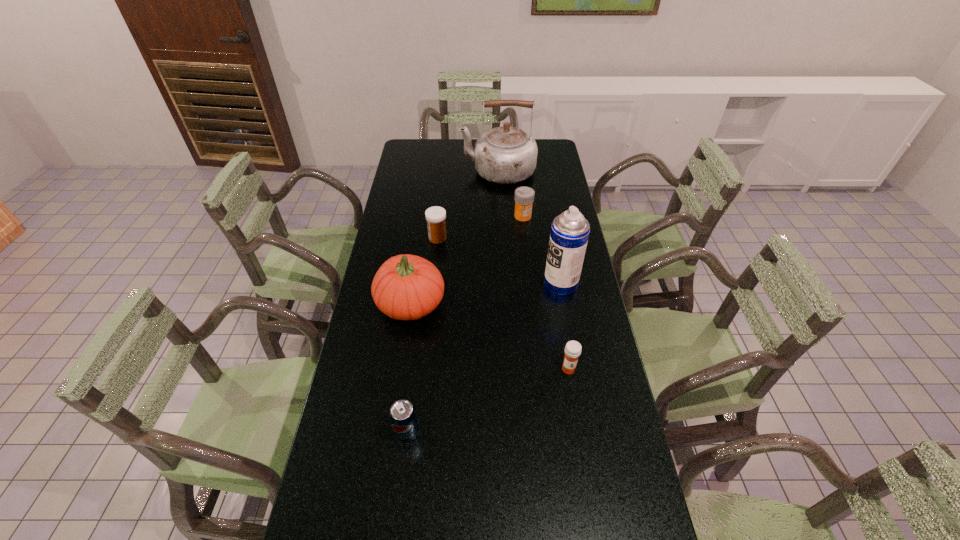
This screenshot has width=960, height=540. What are the coordinates of `the farthest object` in the screenshot? It's located at (505, 155).

Image resolution: width=960 pixels, height=540 pixels. Find the location of `aerosol can`. aerosol can is located at coordinates (569, 235).

The height and width of the screenshot is (540, 960). Find the location of `the fifth shortest object`. the fifth shortest object is located at coordinates (406, 287).

Where is `the second nearest medicine`? The image size is (960, 540). the second nearest medicine is located at coordinates (436, 216).

You are a GUI agent. You are given a task and a screenshot of the screen. Output one action in this format:
    pyautogui.click(x=<x>, y=<y>)
    Task: Click on the third farthest object
    
    Given the screenshot: What is the action you would take?
    pyautogui.click(x=436, y=216)

This screenshot has width=960, height=540. I want to click on the second medicine from left to right, so click(524, 196).

You are a GUI agent. You are given a task and a screenshot of the screen. Output one action in this format:
    pyautogui.click(x=<x>, y=<y>)
    Task: Click on the sixth nearest object
    This screenshot has height=540, width=960.
    Given the screenshot: What is the action you would take?
    pyautogui.click(x=524, y=196)

This screenshot has height=540, width=960. What are the coordinates of `the nearest object` in the screenshot? It's located at (403, 418).

Image resolution: width=960 pixels, height=540 pixels. I want to click on the rightmost medicine, so click(x=573, y=348).

Find the location of `the second nearest object`. the second nearest object is located at coordinates [x=573, y=348].